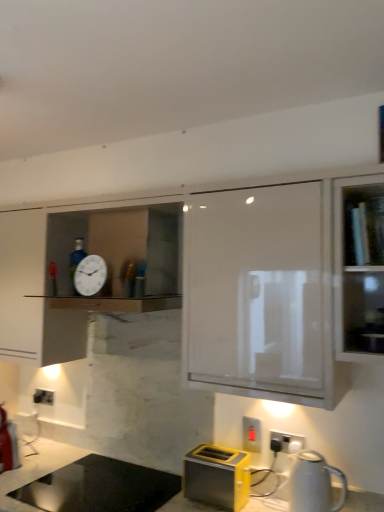
Question: From a real-world perspective, is yellow metallic toaster at lower center physically located above or below white glossy kettle at lower right?

Choices:
 (A) below
 (B) above

Answer: (A)

Question: From the image's perspective, relative to white glossy kettle at lower right, is yellow metallic toaster at lower center above or below?

Choices:
 (A) above
 (B) below

Answer: (B)

Question: Based on their relative distances, which object is farther from the yellow plastic electric outlet at lower right, positioned as the second electric outlet in back-to-front order?

Choices:
 (A) white glossy cabinet at upper center
 (B) clear glass shelf at upper right
 (C) black plastic electrical outlet at lower center, placed as the third electric outlet when sorted from back to front
 (D) yellow metallic toaster at lower center
 (E) white plastic electric outlet at lower left, the 1th electric outlet when ordered from back to front

Answer: (E)

Question: Considering the real-world distances, which object is farthest from the yellow plastic electric outlet at lower right, arranged as the 2th electric outlet when viewed from the front?

Choices:
 (A) clear glass shelf at upper right
 (B) white glossy cabinet at upper center
 (C) marble countertop at lower center
 (D) white glossy kettle at lower right
 (E) white plastic electric outlet at lower left, marked as the first electric outlet in a left-to-right arrangement

Answer: (E)